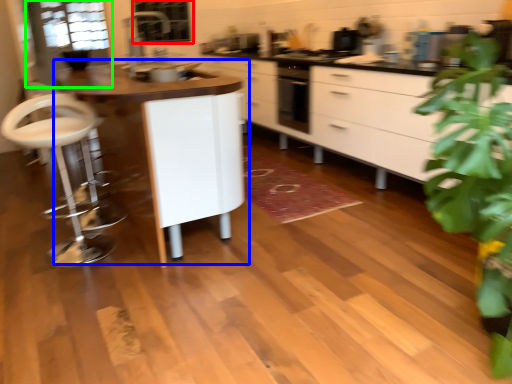
Question: Based on their relative distances, which object is nearer to window screen (highlighted by a red box)? Choose from table (highlighted by a blue box) and glass door (highlighted by a green box).

Choices:
 (A) table
 (B) glass door

Answer: (B)